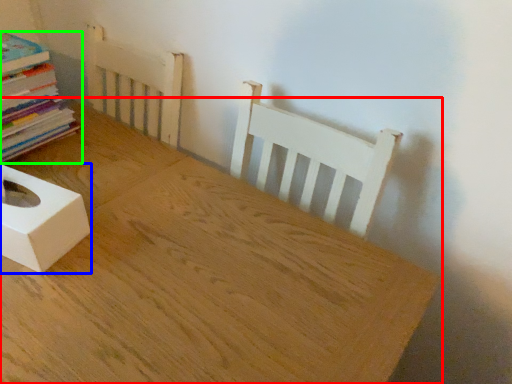
Question: Which is farther away from table (highlighted by a red box)? box (highlighted by a blue box) or book (highlighted by a green box)?

Choices:
 (A) box
 (B) book

Answer: (B)